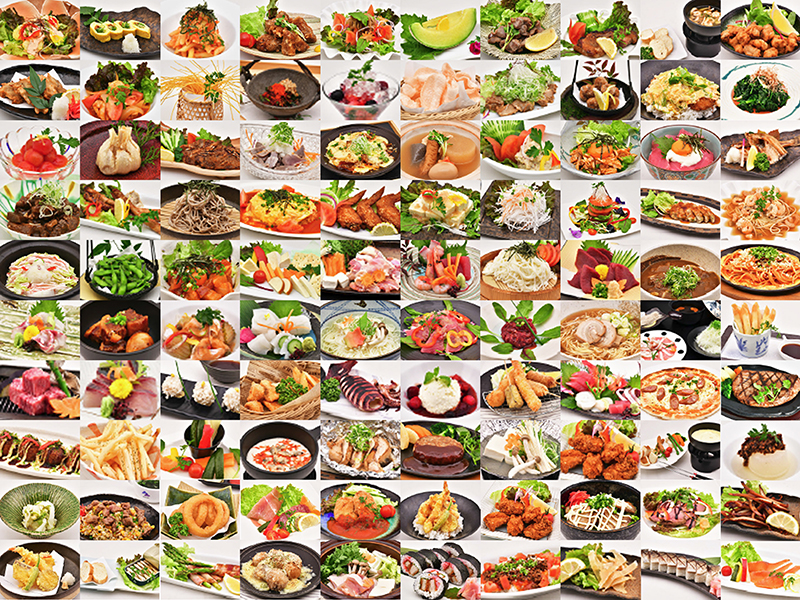
Locate an element on the screen. photographs in bottom row is located at coordinates [x=41, y=567], [x=125, y=565], [x=210, y=568], [x=280, y=572], [x=362, y=576], [x=442, y=575], [x=525, y=577], [x=602, y=575], [x=685, y=572], [x=774, y=574].